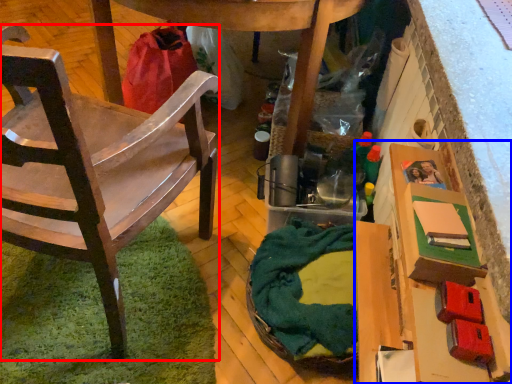
Question: Which object appears farthest to the camera in this image, chair (highlighted by a red box) or cardboard box (highlighted by a blue box)?

Choices:
 (A) chair
 (B) cardboard box

Answer: (B)